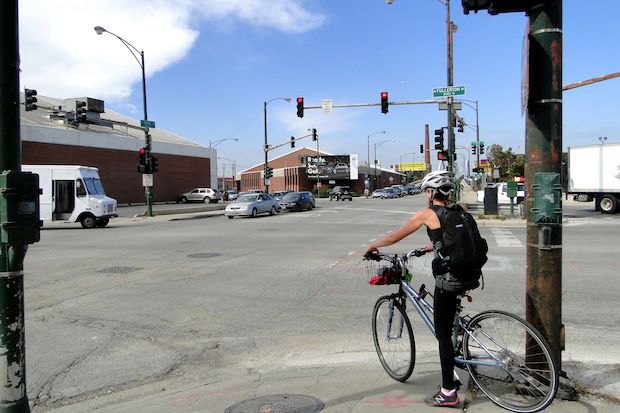
You are a GUI agent. You are given a task and a screenshot of the screen. Output one action in this format:
    pyautogui.click(x=<x>, y=<y>)
    Task: Click on the hvac unit
    
    Given the screenshot: What is the action you would take?
    pyautogui.click(x=95, y=101)